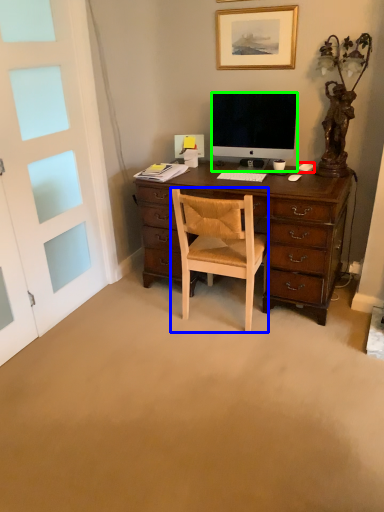
Question: Considering the real-world distances, which object is farthest from computer mouse (highlighted by a red box)? chair (highlighted by a blue box) or television (highlighted by a green box)?

Choices:
 (A) chair
 (B) television

Answer: (A)